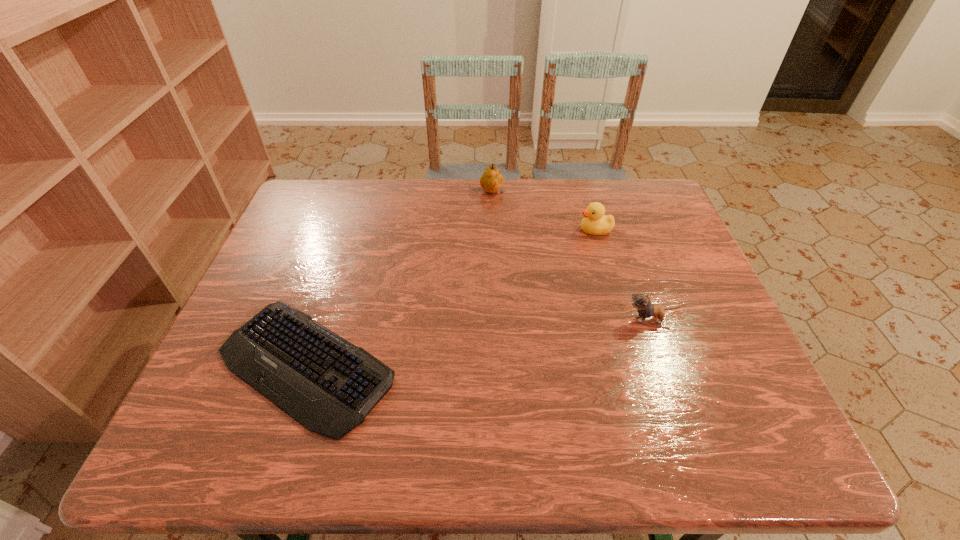
I want to click on vacant area situated 0.050m on the front-facing side of the kitten, so click(603, 319).

Image resolution: width=960 pixels, height=540 pixels. I want to click on vacant position located on the front-facing side of the kitten, so click(x=569, y=319).

Image resolution: width=960 pixels, height=540 pixels. Find the location of `free region located on the front-facing side of the kitten`. free region located on the front-facing side of the kitten is located at coordinates (582, 319).

The image size is (960, 540). I want to click on free space located 0.280m on the right of the shortest object, so click(x=528, y=365).

You are a GUI agent. You are given a task and a screenshot of the screen. Output one action in this format:
    pyautogui.click(x=<x>, y=<y>)
    Task: Click on the pear positioned at the far edge
    This screenshot has height=540, width=960.
    Given the screenshot: What is the action you would take?
    pyautogui.click(x=491, y=181)

Locate an element on the screen. The width and height of the screenshot is (960, 540). duck located at the far edge is located at coordinates (594, 222).

This screenshot has width=960, height=540. What are the coordinates of `object situated at the near edge` in the screenshot? It's located at (329, 385).

This screenshot has width=960, height=540. What are the coordinates of `object present at the left edge` in the screenshot? It's located at (329, 385).

Identify the location of object at the right edge. This screenshot has height=540, width=960. (642, 303).

I want to click on object that is at the near left corner, so click(329, 385).